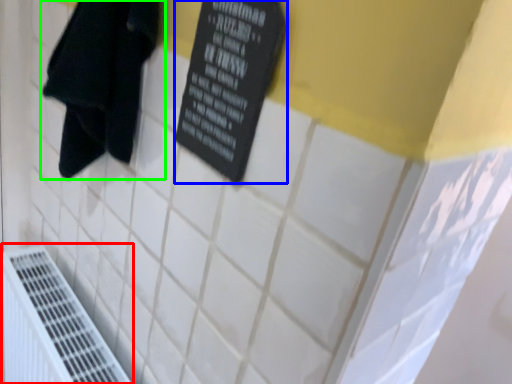
Question: Considering the real-world distances, which object is farthest from air conditioning (highlighted by a red box)? bulletin board (highlighted by a blue box) or towel (highlighted by a green box)?

Choices:
 (A) bulletin board
 (B) towel

Answer: (A)